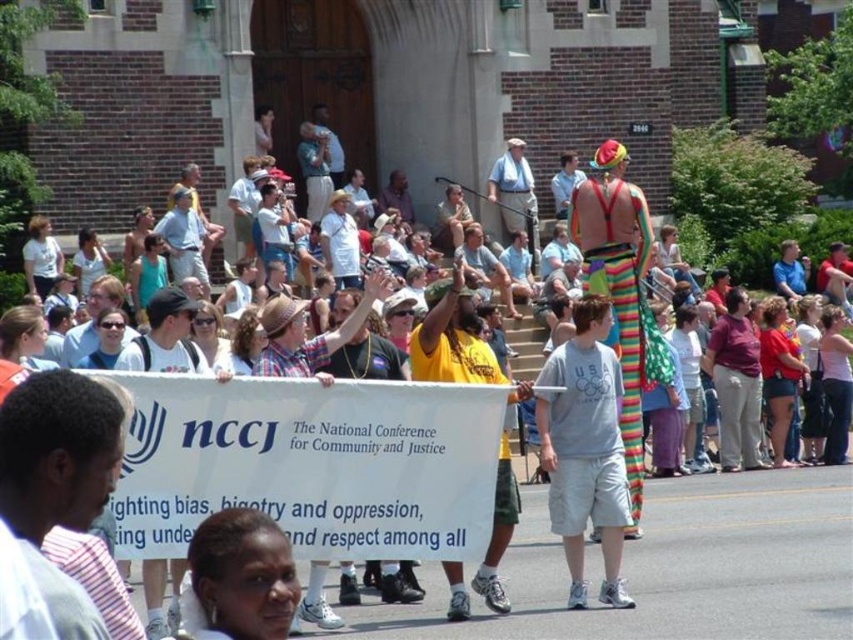
Question: Which of these objects is positioned closest to the yellow shirt at center?

Choices:
 (A) rainbow striped stilts at center
 (B) gray cotton t-shirt at center

Answer: (B)

Question: Does gray cotton t-shirt at center appear on the left side of yellow shirt at center?

Choices:
 (A) yes
 (B) no

Answer: (B)

Question: Which object appears closest to the camera in this image?

Choices:
 (A) gray cotton t-shirt at center
 (B) rainbow striped stilts at center
 (C) yellow shirt at center

Answer: (C)

Question: Estimate the real-world distances between objects in this image. Which object is closer to the rainbow striped stilts at center?

Choices:
 (A) gray cotton t-shirt at center
 (B) yellow shirt at center

Answer: (A)

Question: Is gray cotton t-shirt at center behind yellow shirt at center?

Choices:
 (A) yes
 (B) no

Answer: (A)

Question: Can you confirm if gray cotton t-shirt at center is positioned above yellow shirt at center?

Choices:
 (A) no
 (B) yes

Answer: (A)